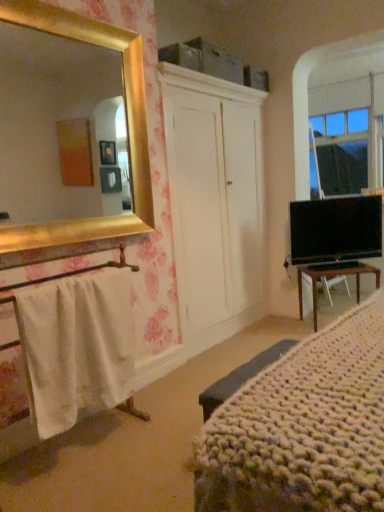
Question: From a real-world perspective, is knitted fabric bed at lower right physically located above or below white cotton towel at left?

Choices:
 (A) below
 (B) above

Answer: (B)

Question: Is knitted fabric bed at lower right spatially inside white cotton towel at left, or outside of it?

Choices:
 (A) outside
 (B) inside

Answer: (A)

Question: Considering the real-world distances, which object is closest to the black glossy tv at right?

Choices:
 (A) knitted fabric bed at lower right
 (B) white cotton towel at left
 (C) brown wooden desk at lower right

Answer: (C)

Question: Which of these objects is positioned closest to the knitted fabric bed at lower right?

Choices:
 (A) white cotton towel at left
 (B) brown wooden desk at lower right
 (C) black glossy tv at right

Answer: (A)